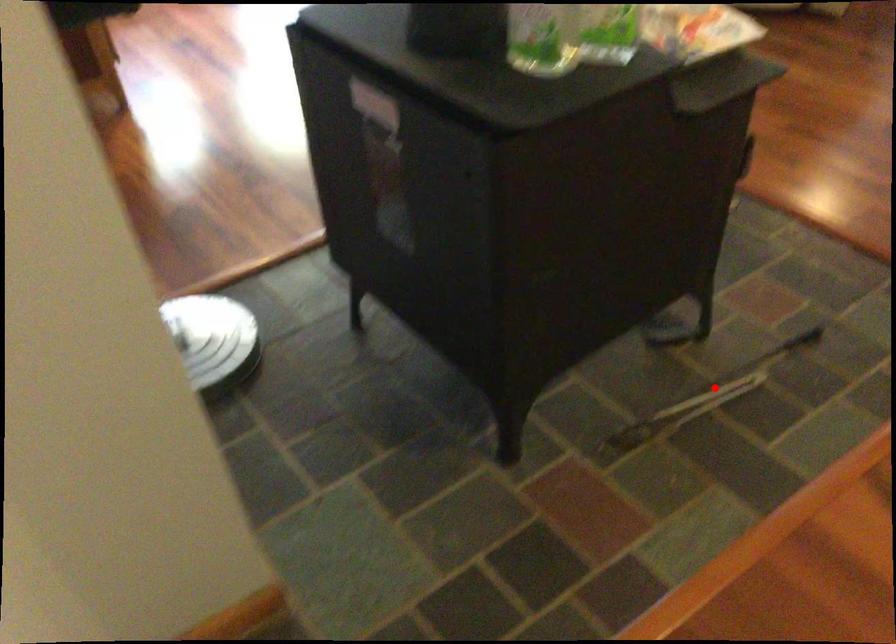
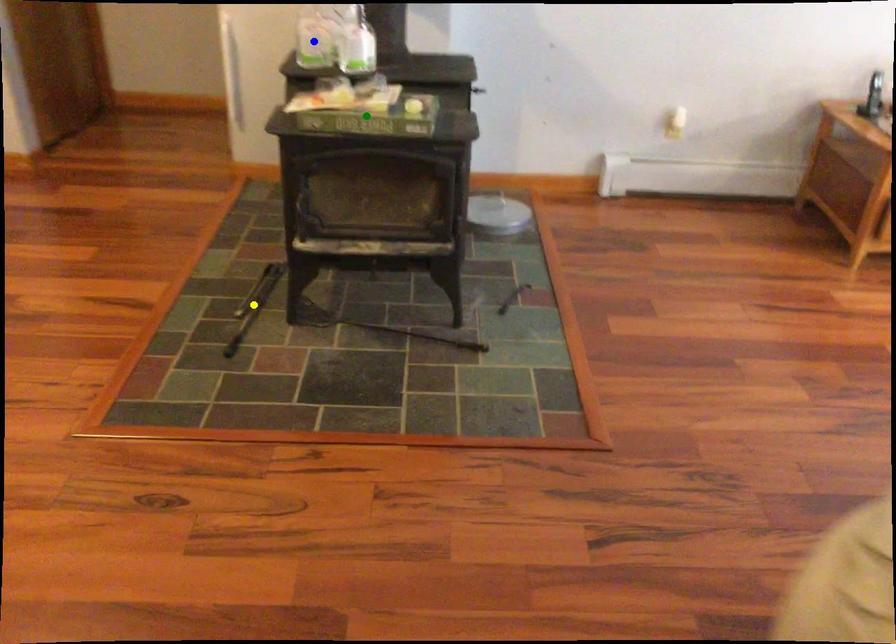
Question: I am providing you with two images of the same scene from different viewpoints. A red point is marked on the first image. You are given multiple points on the second image. Which mark in image 2 goes with the point in image 1?

Choices:
 (A) blue point
 (B) yellow point
 (C) green point

Answer: (B)